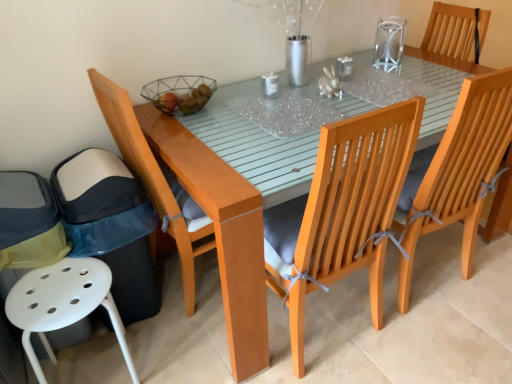
Question: Is wooden chair with grey cushion at right, acting as the 4th chair starting from the left, oriented towards transparent plastic table at center, the 1th glass table viewed from the left?

Choices:
 (A) no
 (B) yes

Answer: (A)

Question: Could transparent plastic table at center, the 1th glass table viewed from the left, be considered to be inside wooden chair with grey cushion at right, the 2th chair positioned from the right?

Choices:
 (A) yes
 (B) no

Answer: (B)

Question: Is wooden chair with grey cushion at right, the 2th chair positioned from the right, oriented away from transparent plastic table at center, the second glass table viewed from the right?

Choices:
 (A) no
 (B) yes

Answer: (A)

Question: Is wooden chair with grey cushion at right, acting as the 4th chair starting from the left, thinner than transparent plastic table at center, the 1th glass table viewed from the left?

Choices:
 (A) yes
 (B) no

Answer: (B)

Question: From the image's perspective, is wooden chair with grey cushion at right, acting as the 4th chair starting from the left, beneath transparent plastic table at center, the second glass table viewed from the right?

Choices:
 (A) yes
 (B) no

Answer: (A)

Question: Is wooden chair with grey cushion at right, the 2th chair positioned from the right, shorter than transparent plastic table at center, the second glass table viewed from the right?

Choices:
 (A) yes
 (B) no

Answer: (B)

Question: Can glossy wood table at center be found inside transparent glass table at upper center, which ranks as the first glass table in right-to-left order?

Choices:
 (A) no
 (B) yes

Answer: (A)

Question: Is transparent glass table at upper center, which ranks as the first glass table in right-to-left order, at the right side of glossy wood table at center?

Choices:
 (A) no
 (B) yes

Answer: (B)

Question: From the image's perspective, is transparent glass table at upper center, arranged as the second glass table when viewed from the left, beneath glossy wood table at center?

Choices:
 (A) yes
 (B) no

Answer: (B)

Question: Does transparent glass table at upper center, which ranks as the first glass table in right-to-left order, lie in front of glossy wood table at center?

Choices:
 (A) yes
 (B) no

Answer: (B)

Question: From a real-world perspective, is transparent glass table at upper center, which ranks as the first glass table in right-to-left order, on top of glossy wood table at center?

Choices:
 (A) yes
 (B) no

Answer: (A)

Question: Is transparent glass table at upper center, arranged as the second glass table when viewed from the left, to the left of glossy wood table at center from the viewer's perspective?

Choices:
 (A) yes
 (B) no

Answer: (B)

Question: Is wooden chair at upper right, which is counted as the 1th chair, starting from the right, further to the viewer compared to light brown wood chair at left, the second chair in the left-to-right sequence?

Choices:
 (A) yes
 (B) no

Answer: (A)